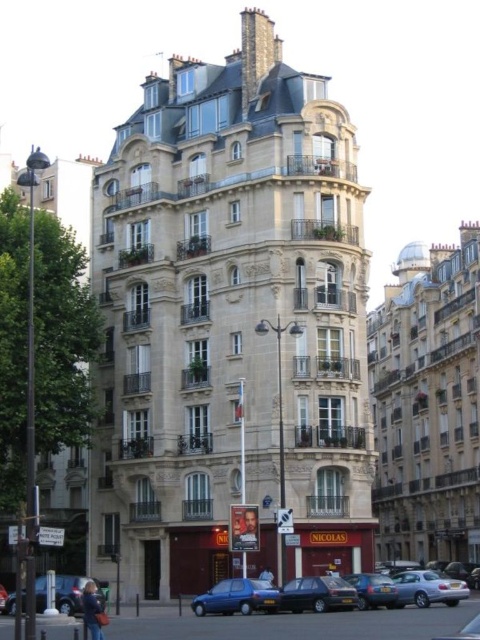
Is blue metallic car at lower left further to the viewer compared to metallic blue car at center?

No, blue metallic car at lower left is in front of metallic blue car at center.

Can you confirm if blue metallic car at lower left is positioned to the right of metallic blue car at center?

Correct, you'll find blue metallic car at lower left to the right of metallic blue car at center.

The height and width of the screenshot is (640, 480). What are the coordinates of `blue metallic car at lower left` in the screenshot? It's located at (69, 593).

Can you confirm if metallic blue car at center is thinner than white cotton shirt at center?

Incorrect, metallic blue car at center's width is not less than white cotton shirt at center's.

Can you confirm if metallic blue car at center is positioned above white cotton shirt at center?

Incorrect, metallic blue car at center is not positioned above white cotton shirt at center.

The image size is (480, 640). Find the location of `metallic blue car at center`. metallic blue car at center is located at coordinates (2, 596).

At what (x,y) coordinates should I click in order to perform the action: click on metallic blue car at center. Please return your answer as a coordinate pair (x, y). This screenshot has width=480, height=640. Looking at the image, I should click on (2, 596).

Between shiny black sedan at center and metallic blue car at center, which one is positioned lower?

metallic blue car at center is lower down.

Does shiny black sedan at center have a greater width compared to metallic blue car at center?

No, shiny black sedan at center is not wider than metallic blue car at center.

Which is in front, point (291, 605) or point (1, 604)?

Point (291, 605) is in front.

You are a GUI agent. You are given a task and a screenshot of the screen. Output one action in this format:
    pyautogui.click(x=<x>, y=<y>)
    Task: Click on the shiny black sedan at center
    
    Given the screenshot: What is the action you would take?
    pyautogui.click(x=316, y=595)